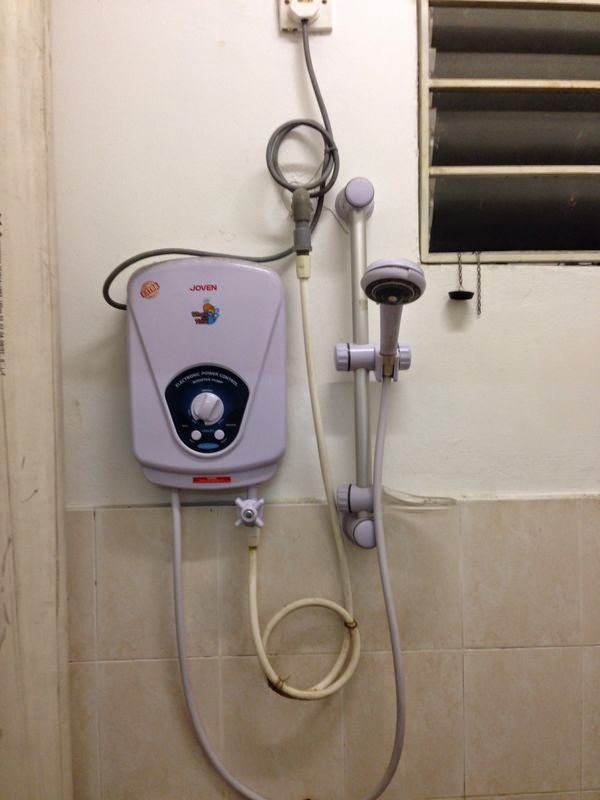
Locate an element on the screen. The height and width of the screenshot is (800, 600). gray wire on the wall is located at coordinates (315, 85).